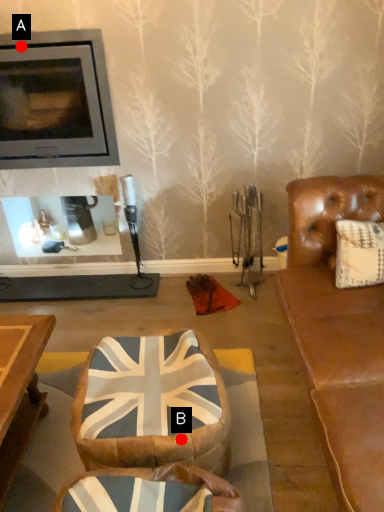
Question: Two points are circled on the image, labeled by A and B beside each circle. Which point is closer to the camera?

Choices:
 (A) A is closer
 (B) B is closer

Answer: (B)